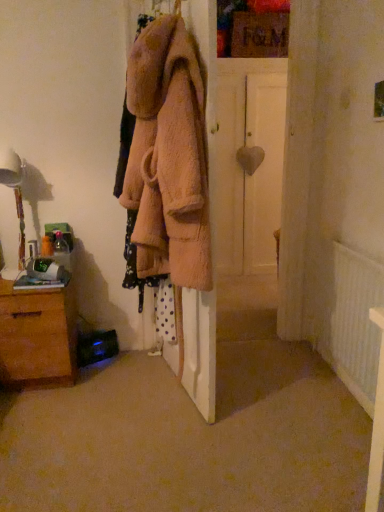
Where is `free point below white textured radiator at lower right (from a real-world perspective)`? The width and height of the screenshot is (384, 512). free point below white textured radiator at lower right (from a real-world perspective) is located at coordinates (337, 384).